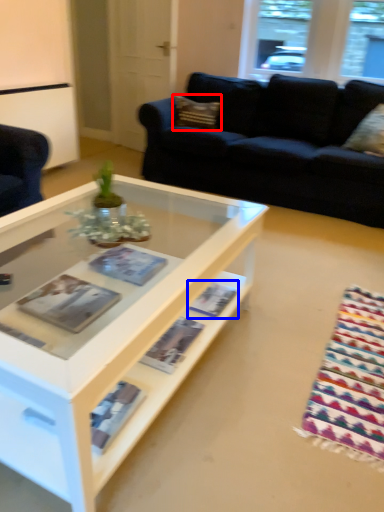
Question: Which of the following is the farthest to the observer, pillow (highlighted by a red box) or magazine (highlighted by a blue box)?

Choices:
 (A) pillow
 (B) magazine

Answer: (A)